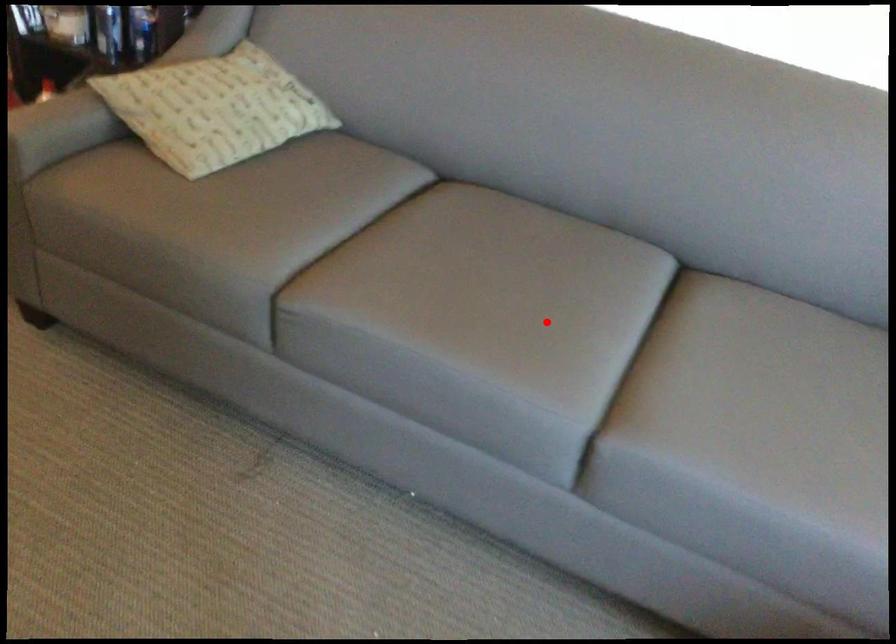
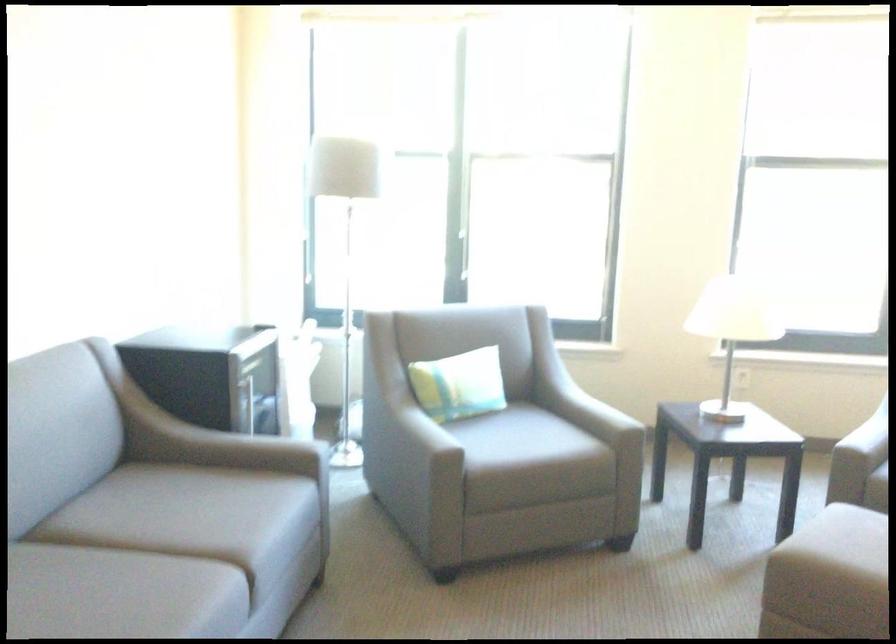
Question: I am providing you with two images of the same scene from different viewpoints. In image1, a red point is highlighted. Considering the same 3D point in image2, which of the following is correct?

Choices:
 (A) It is closer
 (B) It is farther

Answer: (B)